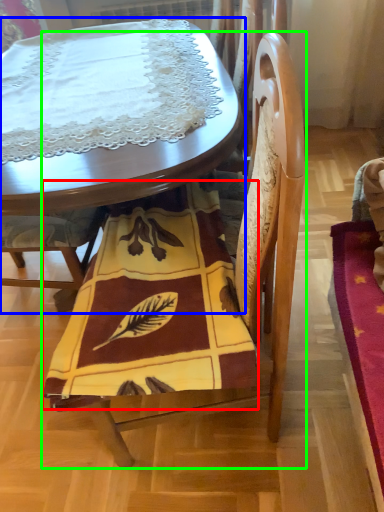
Question: Based on their relative distances, which object is farther from blanket (highlighted by a red box)? Choose from table (highlighted by a blue box) and chair (highlighted by a green box).

Choices:
 (A) table
 (B) chair

Answer: (A)